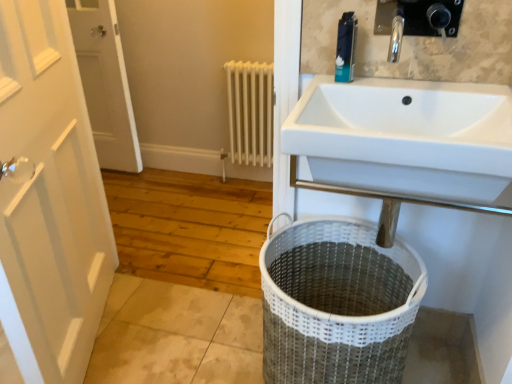
Describe the element at coordinates (105, 83) in the screenshot. I see `white wooden door at left, the first door in the left-to-right sequence` at that location.

What do you see at coordinates (250, 112) in the screenshot?
I see `white metal radiator at center` at bounding box center [250, 112].

This screenshot has height=384, width=512. Find the location of `white wooden door at left, which is the first door from right to left`. white wooden door at left, which is the first door from right to left is located at coordinates (49, 199).

What do you see at coordinates (49, 199) in the screenshot?
I see `white wooden door at left, placed as the 1th door when sorted from front to back` at bounding box center [49, 199].

Where is `white wooden door at left, which is counted as the second door, starting from the front`? The image size is (512, 384). white wooden door at left, which is counted as the second door, starting from the front is located at coordinates (105, 83).

Considering the points (350, 65) and (248, 118), which point is behind, point (350, 65) or point (248, 118)?

Point (248, 118)

Relative to white metal radiator at center, is blue plastic toothpaste tube at upper center in front or behind?

In the image, blue plastic toothpaste tube at upper center appears in front of white metal radiator at center.

Considering the relative positions of blue plastic toothpaste tube at upper center and white metal radiator at center in the image provided, is blue plastic toothpaste tube at upper center to the right of white metal radiator at center from the viewer's perspective?

Yes, blue plastic toothpaste tube at upper center is to the right of white metal radiator at center.

From the image's perspective, does blue plastic toothpaste tube at upper center appear lower than white metal radiator at center?

Yes, from the image's perspective, blue plastic toothpaste tube at upper center is below white metal radiator at center.

Which point is more distant from viewer, [52,124] or [267,137]?

Positioned behind is point [267,137].

Which object is closer to the camera, white wooden door at left, arranged as the 2th door when viewed from the left, or white metal radiator at center?

white wooden door at left, arranged as the 2th door when viewed from the left, is more forward.

Which of these two, white wooden door at left, arranged as the 2th door when viewed from the left, or white metal radiator at center, is bigger?

With larger size is white wooden door at left, arranged as the 2th door when viewed from the left.

Can you confirm if white wooden door at left, arranged as the 2th door when viewed from the left, is wider than white metal radiator at center?

Yes.

Considering the relative positions of blue plastic toothpaste tube at upper center and white wooden door at left, placed as the 1th door when sorted from front to back, in the image provided, is blue plastic toothpaste tube at upper center in front of white wooden door at left, placed as the 1th door when sorted from front to back,?

No, blue plastic toothpaste tube at upper center is further to the viewer.

Which point is more forward, (344,80) or (8,288)?

The point (8,288) is in front.

From the image's perspective, is blue plastic toothpaste tube at upper center located above white wooden door at left, placed as the 1th door when sorted from front to back?

Yes, from the image's perspective, blue plastic toothpaste tube at upper center is over white wooden door at left, placed as the 1th door when sorted from front to back.

Is the depth of white metal radiator at center greater than that of white wooden door at left, marked as the 2th door in a right-to-left arrangement?

No, the depth of white metal radiator at center is less than that of white wooden door at left, marked as the 2th door in a right-to-left arrangement.

How different are the orientations of white metal radiator at center and white wooden door at left, which is counted as the second door, starting from the front, in degrees?

2.43 degrees.

Are white metal radiator at center and white wooden door at left, the first door in the left-to-right sequence, making contact?

No, white metal radiator at center is not making contact with white wooden door at left, the first door in the left-to-right sequence.

From a real-world perspective, is white metal radiator at center above or below white wooden door at left, marked as the 2th door in a right-to-left arrangement?

Clearly, from a real-world perspective, white metal radiator at center is below white wooden door at left, marked as the 2th door in a right-to-left arrangement.

Is white metal radiator at center turned away from white woven laundry basket at lower center?

white metal radiator at center is not turned away from white woven laundry basket at lower center.

Which object is further away from the camera, white metal radiator at center or white woven laundry basket at lower center?

white metal radiator at center is behind.

Does white metal radiator at center have a greater height compared to white woven laundry basket at lower center?

Indeed, white metal radiator at center has a greater height compared to white woven laundry basket at lower center.

In the scene shown: Considering the sizes of objects white metal radiator at center and white woven laundry basket at lower center in the image provided, who is smaller, white metal radiator at center or white woven laundry basket at lower center?

Smaller between the two is white metal radiator at center.

Can you confirm if white metal radiator at center is bigger than white wooden door at left, placed as the 1th door when sorted from front to back?

No.

From the picture: Which is more to the left, white metal radiator at center or white wooden door at left, placed as the 1th door when sorted from front to back?

white wooden door at left, placed as the 1th door when sorted from front to back, is more to the left.

The width and height of the screenshot is (512, 384). Find the location of `radiator that is behind the white wooden door at left, which is the first door from right to left`. radiator that is behind the white wooden door at left, which is the first door from right to left is located at coordinates (250, 112).

Is white metal radiator at center oriented away from white wooden door at left, placed as the 1th door when sorted from front to back?

white metal radiator at center does not have its back to white wooden door at left, placed as the 1th door when sorted from front to back.

Are white wooden door at left, the first door in the left-to-right sequence, and blue plastic toothpaste tube at upper center located far from each other?

Indeed, white wooden door at left, the first door in the left-to-right sequence, is not near blue plastic toothpaste tube at upper center.

You are a GUI agent. You are given a task and a screenshot of the screen. Output one action in this format:
    pyautogui.click(x=<x>, y=<y>)
    Task: Click on the toiletry on the right of white wooden door at left, marked as the 2th door in a right-to-left arrangement
    The height and width of the screenshot is (384, 512).
    Given the screenshot: What is the action you would take?
    pyautogui.click(x=346, y=47)

Which of these two, white wooden door at left, placed as the first door when sorted from back to front, or blue plastic toothpaste tube at upper center, stands shorter?

blue plastic toothpaste tube at upper center.

Find the location of a particular element. Image resolution: width=512 pixels, height=384 pixels. toiletry lying on the right of white metal radiator at center is located at coordinates [x=346, y=47].

Identify the location of radiator that appears behind the white wooden door at left, which is the first door from right to left. This screenshot has width=512, height=384. (250, 112).

When comparing their distances from white wooden door at left, which is counted as the second door, starting from the front, does white wooden door at left, placed as the 1th door when sorted from front to back, or white metal radiator at center seem closer?

Among the two, white metal radiator at center is located nearer to white wooden door at left, which is counted as the second door, starting from the front.

Considering their positions, is blue plastic toothpaste tube at upper center positioned closer to white wooden door at left, the first door in the left-to-right sequence, than white metal radiator at center?

white metal radiator at center is positioned closer to the anchor white wooden door at left, the first door in the left-to-right sequence.

Estimate the real-world distances between objects in this image. Which object is closer to white wooden door at left, placed as the first door when sorted from back to front, white metal radiator at center or blue plastic toothpaste tube at upper center?

Based on the image, white metal radiator at center appears to be nearer to white wooden door at left, placed as the first door when sorted from back to front.

From the image, which object appears to be farther from white wooden door at left, marked as the 2th door in a right-to-left arrangement, white woven laundry basket at lower center or white metal radiator at center?

white woven laundry basket at lower center is further to white wooden door at left, marked as the 2th door in a right-to-left arrangement.

When comparing their distances from white wooden door at left, the second door in the back-to-front sequence, does white metal radiator at center or white wooden door at left, placed as the first door when sorted from back to front, seem closer?

white metal radiator at center lies closer to white wooden door at left, the second door in the back-to-front sequence, than the other object.

Estimate the real-world distances between objects in this image. Which object is further from white metal radiator at center, white woven laundry basket at lower center or blue plastic toothpaste tube at upper center?

blue plastic toothpaste tube at upper center is further to white metal radiator at center.

When comparing their distances from white wooden door at left, the second door in the back-to-front sequence, does white woven laundry basket at lower center or white metal radiator at center seem closer?

white woven laundry basket at lower center.

When comparing their distances from blue plastic toothpaste tube at upper center, does white wooden door at left, the second door in the back-to-front sequence, or white metal radiator at center seem closer?

white wooden door at left, the second door in the back-to-front sequence, lies closer to blue plastic toothpaste tube at upper center than the other object.

Identify the location of toiletry between white woven laundry basket at lower center and white metal radiator at center in the front-back direction. (346, 47).

This screenshot has height=384, width=512. I want to click on toiletry between white woven laundry basket at lower center and white wooden door at left, placed as the first door when sorted from back to front, along the z-axis, so click(x=346, y=47).

Image resolution: width=512 pixels, height=384 pixels. In order to click on laundry basket located between white wooden door at left, placed as the 1th door when sorted from front to back, and white wooden door at left, the first door in the left-to-right sequence, in the depth direction in this screenshot , I will do `click(337, 304)`.

Find the location of a particular element. laundry basket positioned between white wooden door at left, arranged as the 2th door when viewed from the left, and white metal radiator at center from near to far is located at coordinates (337, 304).